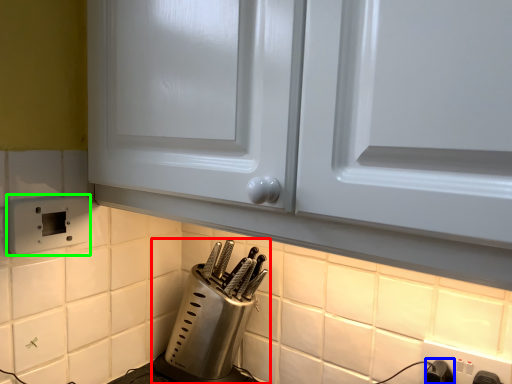
Question: Which object is the closest to the kitchen appliance (highlighted by a red box)? Choose among these: switch (highlighted by a blue box) or electric outlet (highlighted by a green box).

Choices:
 (A) switch
 (B) electric outlet

Answer: (B)